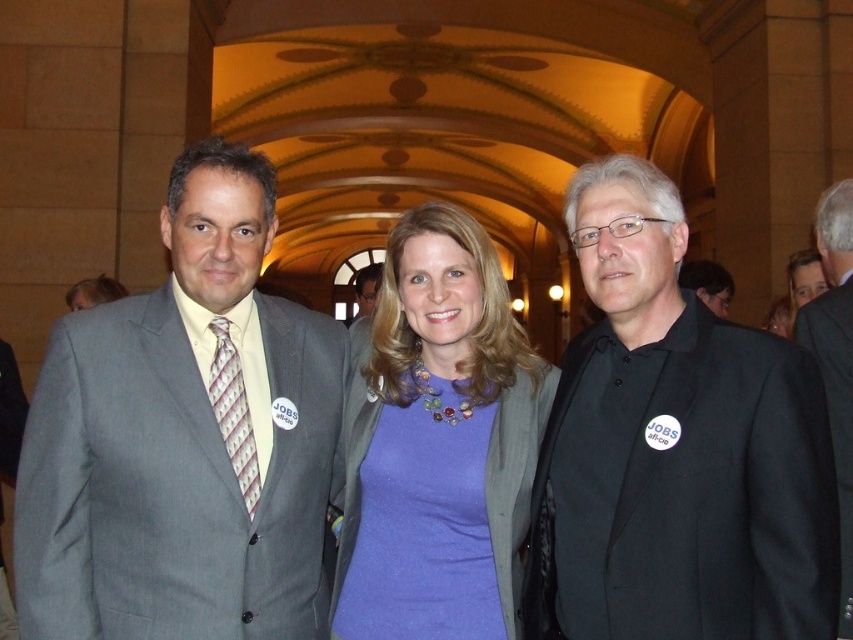
Question: Can you confirm if black fabric suit at right is wider than black matte suit at center?

Choices:
 (A) no
 (B) yes

Answer: (B)

Question: Which point is farther from the camera taking this photo?

Choices:
 (A) (585, 372)
 (B) (376, 291)

Answer: (B)

Question: Which point appears farthest from the camera in this image?

Choices:
 (A) (805, 308)
 (B) (437, 387)
 (C) (363, 300)

Answer: (C)

Question: Among these objects, which one is nearest to the camera?

Choices:
 (A) matte gray suit at left
 (B) black matte suit at center
 (C) black matte shirt at center

Answer: (C)

Question: Does black matte shirt at center have a lesser width compared to black matte suit at center?

Choices:
 (A) no
 (B) yes

Answer: (B)

Question: Is matte gray suit at left below matte gray suit at center?

Choices:
 (A) no
 (B) yes

Answer: (B)